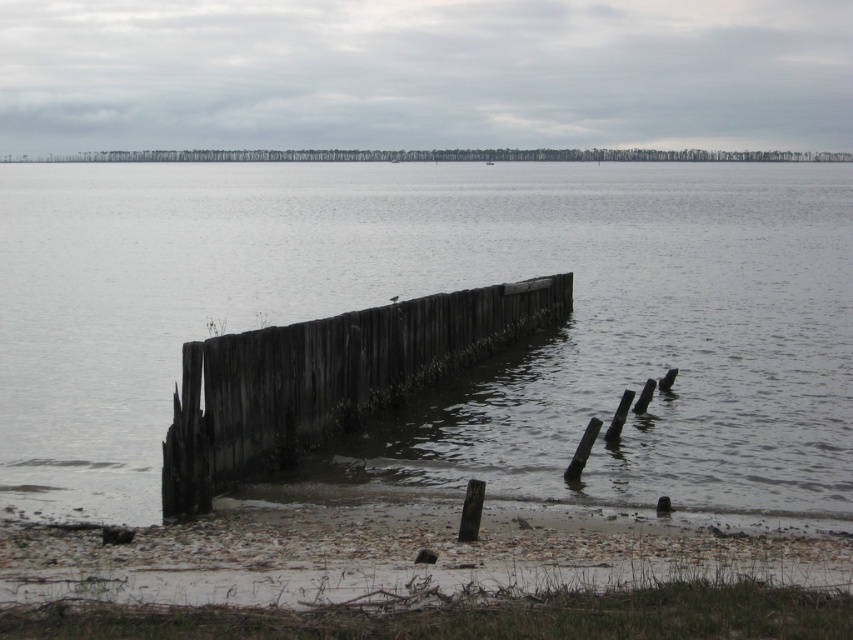
Is smooth sand shoreline at lower center bigger than weathered wood dock at center?

No, smooth sand shoreline at lower center is not bigger than weathered wood dock at center.

Is smooth sand shoreline at lower center in front of weathered wood dock at center?

Yes, smooth sand shoreline at lower center is in front of weathered wood dock at center.

Describe the element at coordinates (401, 554) in the screenshot. I see `smooth sand shoreline at lower center` at that location.

Image resolution: width=853 pixels, height=640 pixels. I want to click on smooth sand shoreline at lower center, so [x=401, y=554].

Which is below, weathered wood water at center or smooth sand shoreline at lower center?

Positioned lower is smooth sand shoreline at lower center.

Is point (740, 381) closer to camera compared to point (294, 545)?

No, (740, 381) is further to viewer.

Locate an element on the screen. The height and width of the screenshot is (640, 853). weathered wood water at center is located at coordinates (438, 291).

This screenshot has width=853, height=640. In order to click on weathered wood water at center in this screenshot , I will do pyautogui.click(x=438, y=291).

Between weathered wood water at center and weathered wood dock at center, which one is positioned higher?

weathered wood water at center is higher up.

Does weathered wood water at center come behind weathered wood dock at center?

Yes, it is behind weathered wood dock at center.

Locate an element on the screen. This screenshot has height=640, width=853. weathered wood water at center is located at coordinates (438, 291).